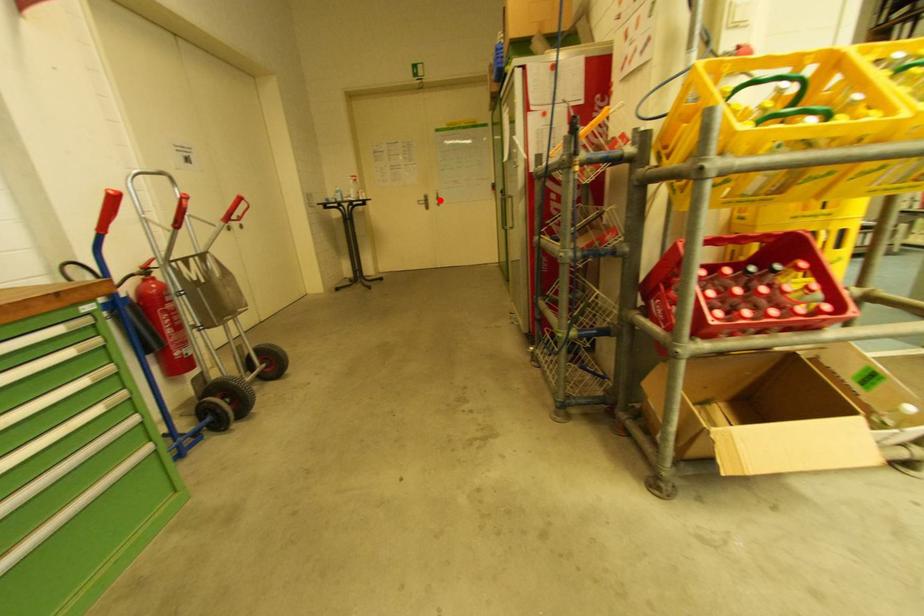
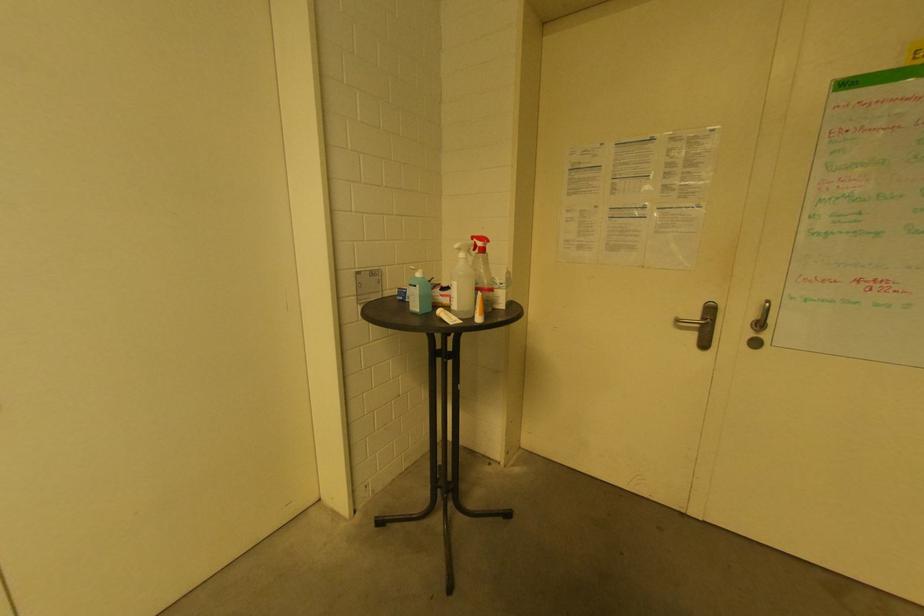
Question: I am providing you with two images of the same scene from different viewpoints. A red point is marked on the first image. Can you still see the location of the red point in image 2?

Choices:
 (A) Yes
 (B) No

Answer: (A)